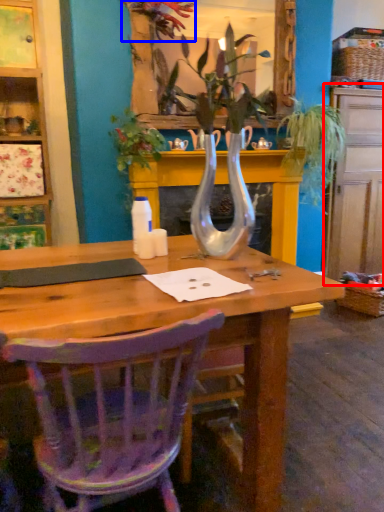
Question: Which point is closer to the camera, dresser (highlighted by a red box) or flower (highlighted by a blue box)?

Choices:
 (A) dresser
 (B) flower

Answer: (B)